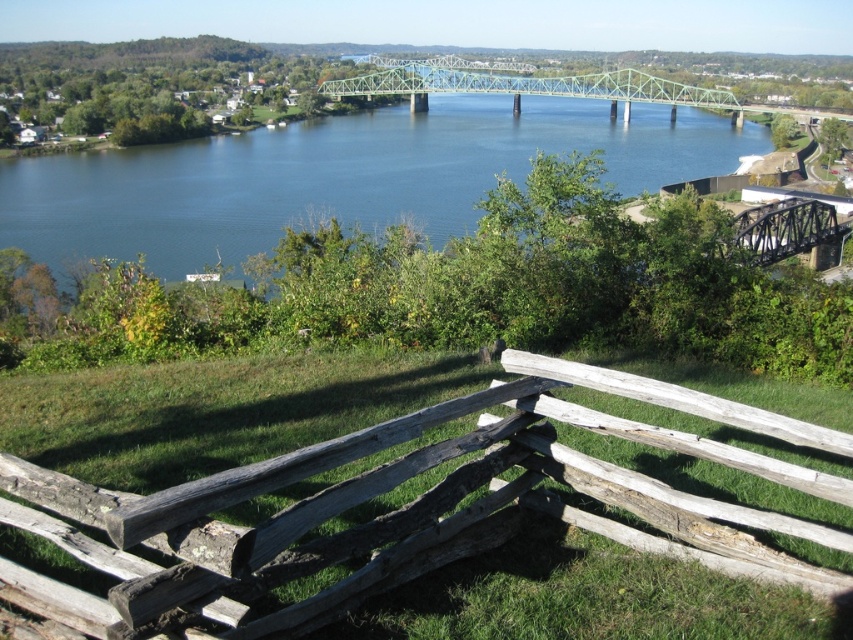
Which is behind, point (747, 561) or point (674, 180)?

The point (674, 180) is behind.

The image size is (853, 640). Find the location of `weathered wood fence at lower center`. weathered wood fence at lower center is located at coordinates (173, 438).

The width and height of the screenshot is (853, 640). I want to click on weathered wood fence at lower center, so click(173, 438).

Is blue water at center positioned before green metallic bridge at center?

Yes.

The height and width of the screenshot is (640, 853). What do you see at coordinates (338, 177) in the screenshot?
I see `blue water at center` at bounding box center [338, 177].

Describe the element at coordinates (338, 177) in the screenshot. This screenshot has height=640, width=853. I see `blue water at center` at that location.

The height and width of the screenshot is (640, 853). Find the location of `blue water at center`. blue water at center is located at coordinates [338, 177].

Does weathered wood fence at lower center have a smaller size compared to green metallic bridge at center?

Yes, weathered wood fence at lower center is smaller than green metallic bridge at center.

Who is more distant from viewer, (442, 605) or (549, 83)?

The point (549, 83) is more distant.

Is point (312, 387) in front of point (345, 77)?

Yes, point (312, 387) is in front of point (345, 77).

Identify the location of weathered wood fence at lower center. This screenshot has height=640, width=853. (173, 438).